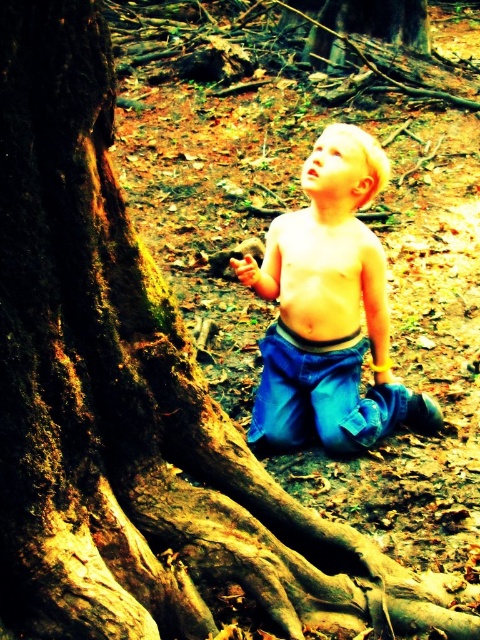
Based on the scene described, can the child wearing the blue denim jeans at center and smooth skin torso at center comfortably sit crosslegged on the ground without their jeans restricting movement?

The blue denim jeans at center might be wider than smooth skin torso at center, so it is possible that the child can sit crosslegged comfortably as the jeans may allow for more movement compared to a tighter fit.

You are standing in a forest and see a point marked at coordinates (351, 380). If you want to place a 10 feet long rope from your current position to that point, will it reach?

The point at (351, 380) is 8.57 feet away from the viewer. Since the rope is 10 feet long, it will reach the point with some extra length remaining.